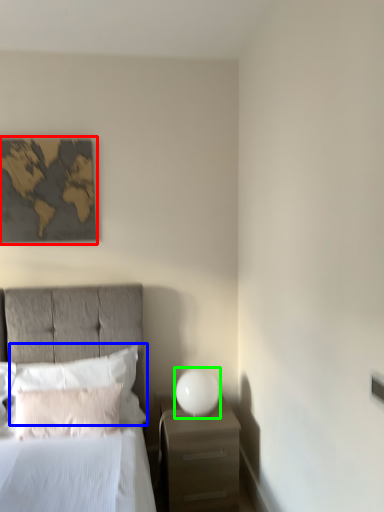
Question: Which object is positioned farthest from picture frame (highlighted by a red box)? Select from pillow (highlighted by a blue box) and bedside lamp (highlighted by a green box).

Choices:
 (A) pillow
 (B) bedside lamp

Answer: (B)